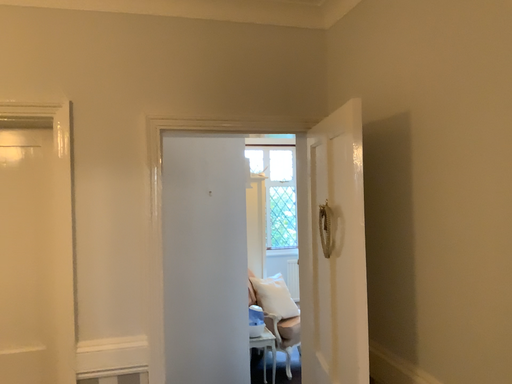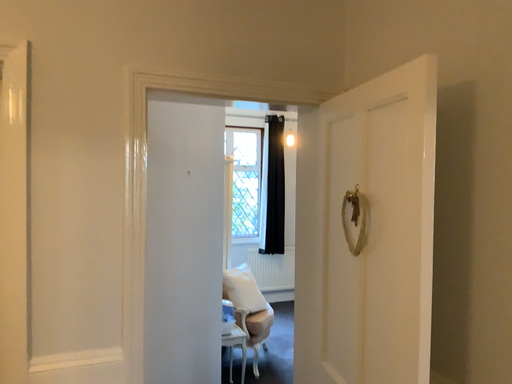
Question: Which way did the camera rotate in the video?

Choices:
 (A) rotated right
 (B) rotated left

Answer: (A)